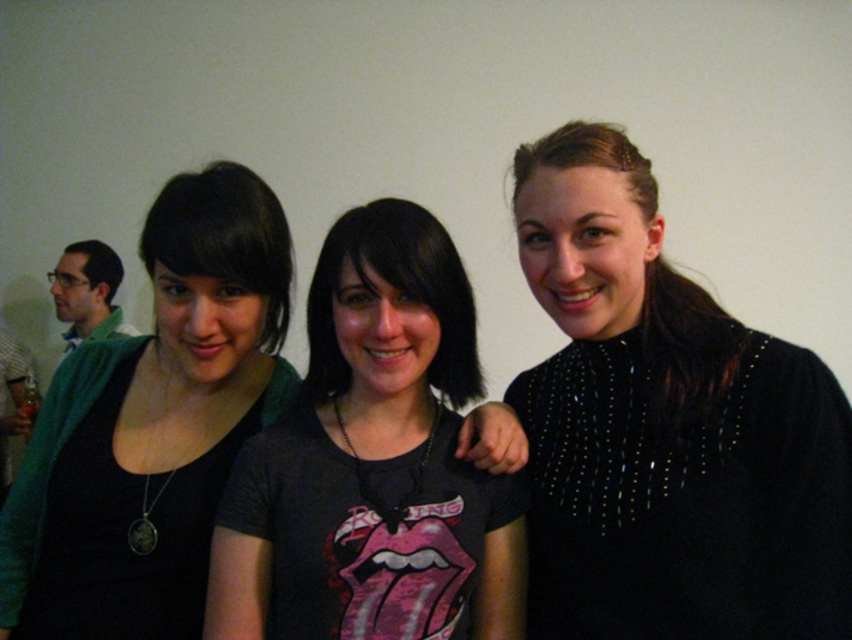
Question: Observing the image, what is the correct spatial positioning of black sequined top at right in reference to green fabric shirt at left?

Choices:
 (A) below
 (B) above

Answer: (A)

Question: Does black sequined top at right have a lesser width compared to green fabric shirt at left?

Choices:
 (A) yes
 (B) no

Answer: (A)

Question: Which object appears closest to the camera in this image?

Choices:
 (A) green fabric shirt at left
 (B) black t-shirt with graphic at center

Answer: (B)

Question: Which of the following is the closest to the observer?

Choices:
 (A) green fabric shirt at left
 (B) black t-shirt with graphic at center
 (C) matte black shirt at center

Answer: (B)

Question: Is black t-shirt with graphic at center closer to camera compared to matte black shirt at center?

Choices:
 (A) no
 (B) yes

Answer: (B)

Question: Estimate the real-world distances between objects in this image. Which object is closer to the black t-shirt with graphic at center?

Choices:
 (A) green fabric shirt at left
 (B) matte black shirt at center

Answer: (B)